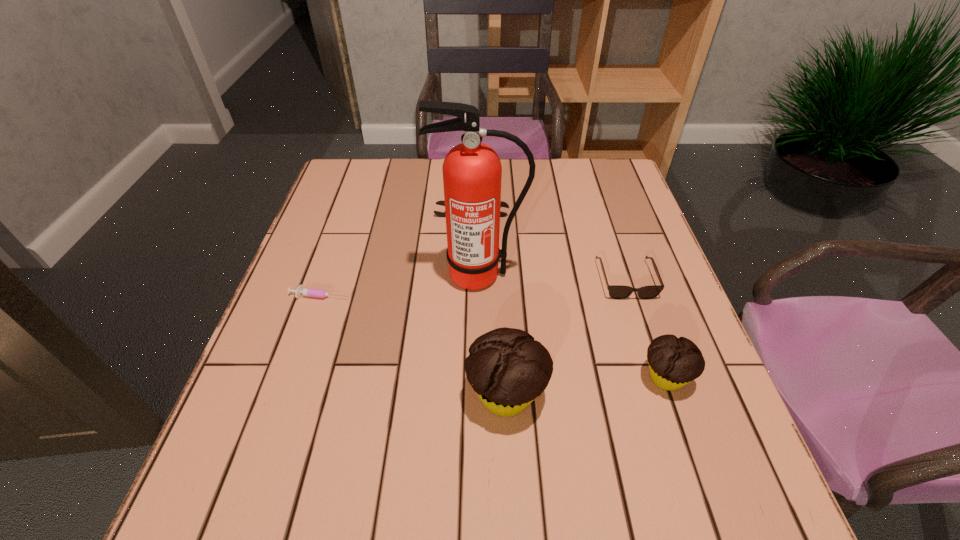
This screenshot has width=960, height=540. In the image, there is a desktop. Identify the location of vacant space at the near edge. (611, 412).

The width and height of the screenshot is (960, 540). Find the location of `vacant space at the left edge of the desktop`. vacant space at the left edge of the desktop is located at coordinates (285, 338).

The width and height of the screenshot is (960, 540). In the image, there is a desktop. Find the location of `vacant space at the right edge`. vacant space at the right edge is located at coordinates (613, 301).

In the image, there is a desktop. Identify the location of vacant region at the far left corner. (384, 173).

Find the location of a particular element. The width and height of the screenshot is (960, 540). vacant space at the far right corner is located at coordinates (628, 195).

Image resolution: width=960 pixels, height=540 pixels. In order to click on free space between the tallest object and the shorter muffin in this screenshot , I will do tap(572, 327).

Find the location of `vacant space that's between the syringe and the fire extinguisher`. vacant space that's between the syringe and the fire extinguisher is located at coordinates (400, 285).

The width and height of the screenshot is (960, 540). Find the location of `empty space that is in between the tallest object and the right muffin`. empty space that is in between the tallest object and the right muffin is located at coordinates (572, 327).

The width and height of the screenshot is (960, 540). I want to click on blank region between the sunglasses and the right muffin, so [645, 328].

Where is `vacant region between the farthest object and the shortest object`? The width and height of the screenshot is (960, 540). vacant region between the farthest object and the shortest object is located at coordinates (396, 256).